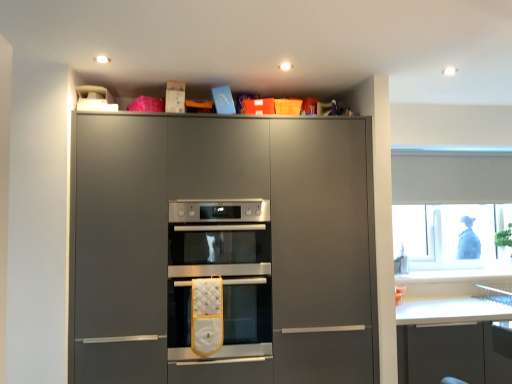
Question: Does white quilted oven mitt at center, the second oven viewed from the top, have a greater height compared to matte gray oven at center?

Choices:
 (A) no
 (B) yes

Answer: (A)

Question: From a real-world perspective, is white quilted oven mitt at center, the second oven viewed from the top, positioned under matte gray oven at center based on gravity?

Choices:
 (A) yes
 (B) no

Answer: (A)

Question: Is white quilted oven mitt at center, the second oven viewed from the top, bigger than matte gray oven at center?

Choices:
 (A) no
 (B) yes

Answer: (A)

Question: Does white quilted oven mitt at center, the second oven viewed from the top, turn towards matte gray oven at center?

Choices:
 (A) no
 (B) yes

Answer: (B)

Question: Are white quilted oven mitt at center, which is the first oven from bottom to top, and matte gray oven at center making contact?

Choices:
 (A) no
 (B) yes

Answer: (A)

Question: Can you confirm if white quilted oven mitt at center, which is the first oven from bottom to top, is positioned to the left of matte gray oven at center?

Choices:
 (A) no
 (B) yes

Answer: (B)

Question: Considering the relative sizes of transparent plastic window at upper right and white quilted oven mitt at center, which is the first oven from bottom to top, in the image provided, is transparent plastic window at upper right smaller than white quilted oven mitt at center, which is the first oven from bottom to top,?

Choices:
 (A) yes
 (B) no

Answer: (B)

Question: Is transparent plastic window at upper right not inside white quilted oven mitt at center, which is the first oven from bottom to top?

Choices:
 (A) no
 (B) yes

Answer: (B)

Question: From a real-world perspective, is transparent plastic window at upper right over white quilted oven mitt at center, the second oven viewed from the top?

Choices:
 (A) yes
 (B) no

Answer: (A)

Question: From the image's perspective, does transparent plastic window at upper right appear lower than white quilted oven mitt at center, the second oven viewed from the top?

Choices:
 (A) yes
 (B) no

Answer: (B)

Question: Does transparent plastic window at upper right contain white quilted oven mitt at center, which is the first oven from bottom to top?

Choices:
 (A) no
 (B) yes

Answer: (A)

Question: Does transparent plastic window at upper right appear on the left side of white quilted oven mitt at center, which is the first oven from bottom to top?

Choices:
 (A) no
 (B) yes

Answer: (A)

Question: Does matte gray oven at center appear on the left side of transparent plastic window at upper right?

Choices:
 (A) yes
 (B) no

Answer: (A)